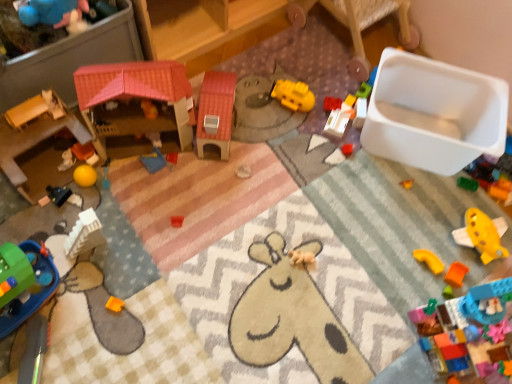
Locate an element on the screen. The height and width of the screenshot is (384, 512). vacant space to the right of black plastic toy at lower left, arranged as the 3th toy when viewed from the left is located at coordinates (112, 205).